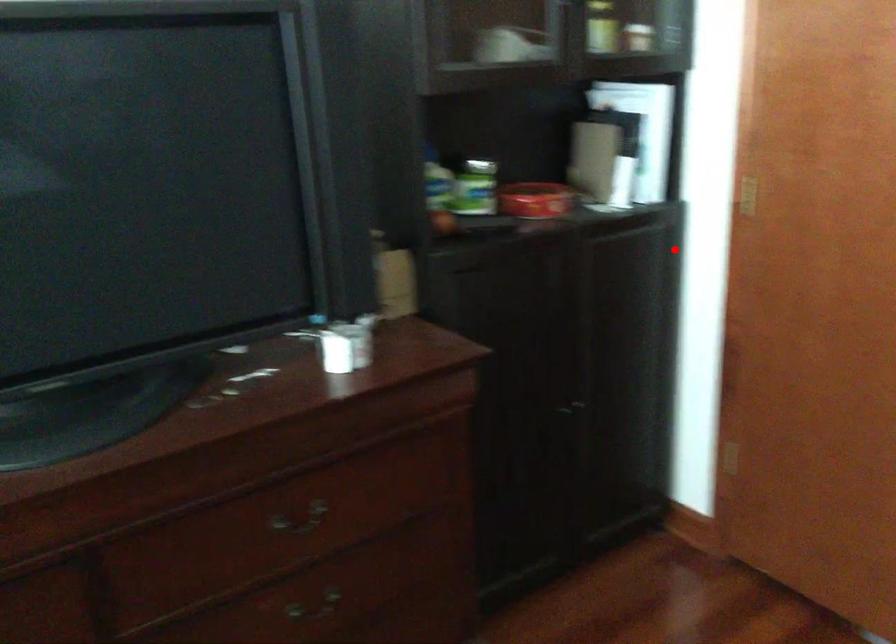
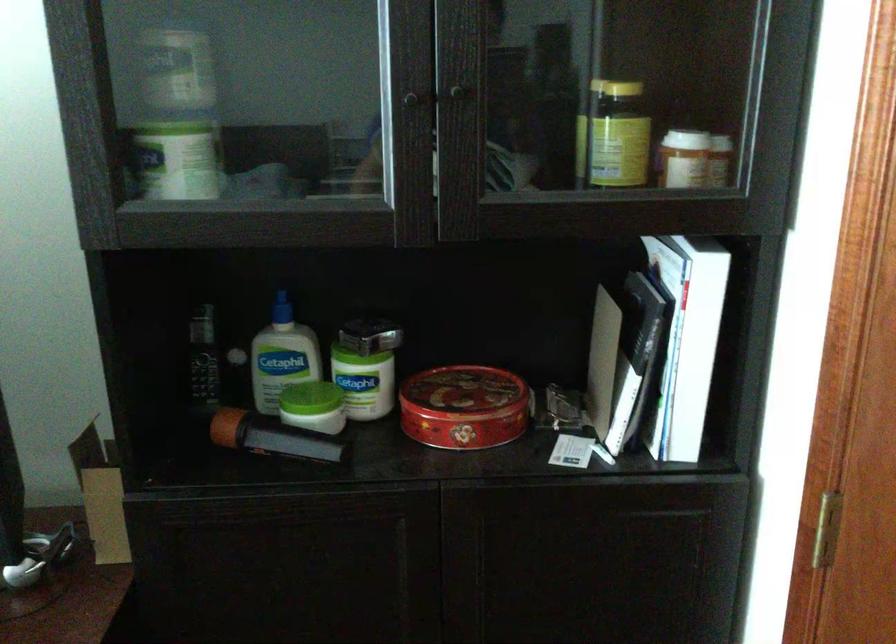
Question: I am providing you with two images of the same scene from different viewpoints. A red point is marked on the first image. Is the red point's position out of view in image 2?

Choices:
 (A) Yes
 (B) No

Answer: (B)